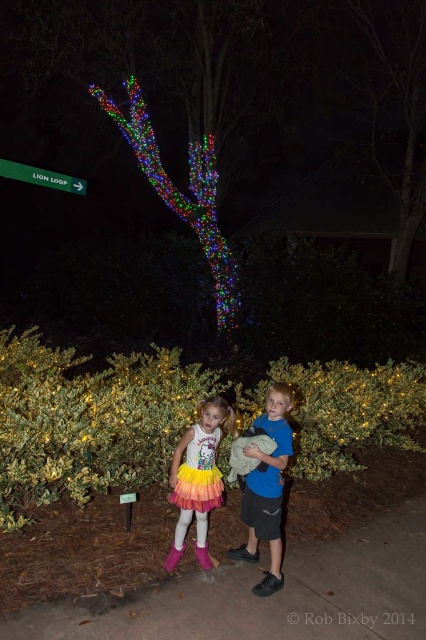
Question: Which object is farther from the camera taking this photo?

Choices:
 (A) rainbow tulle dress at center
 (B) pink suede boot at lower center

Answer: (B)

Question: Which object is the farthest from the green plastic sign at upper left?

Choices:
 (A) gray concrete pavement at lower center
 (B) colorful lights at upper center
 (C) blue fabric shirt at center
 (D) pink suede boot at lower center

Answer: (A)

Question: Is gray concrete pavement at lower center above pink rubber boot at lower center?

Choices:
 (A) yes
 (B) no

Answer: (B)

Question: Is the position of blue fabric shirt at center less distant than that of pink suede boot at lower center?

Choices:
 (A) yes
 (B) no

Answer: (A)

Question: Which point is farther from the camera taking this photo?

Choices:
 (A) (183, 218)
 (B) (215, 445)
 (C) (8, 170)

Answer: (A)

Question: Is green leafy bush at lower center to the right of green plastic sign at upper left from the viewer's perspective?

Choices:
 (A) no
 (B) yes

Answer: (B)